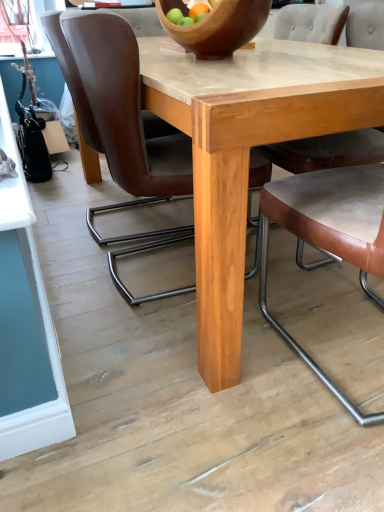
Identify the location of free spot in front of wooden bowl at center. (245, 69).